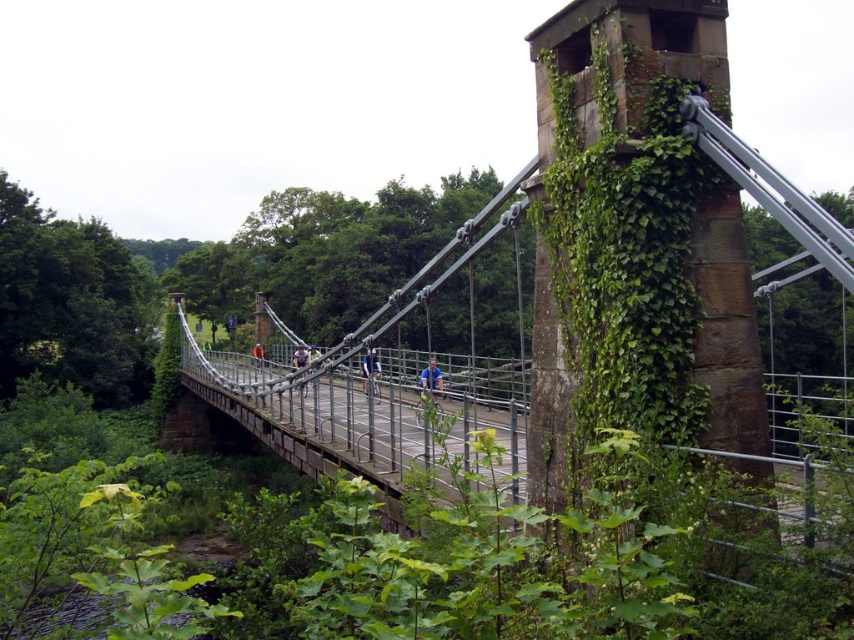
You are a pedestrian standing on the suspension bridge. You see a blue fabric jacket at center and a metallic silver bicycle at center. Which object is closer to your right side?

The blue fabric jacket at center is positioned on the right side of the metallic silver bicycle at center, so it is closer to your right side.

You are a hiker planning to cross the metallic gray bridge at center while wearing an orange fabric jacket at center. Considering their sizes, which one occupies more visual space in the image?

The metallic gray bridge at center has a larger size compared to the orange fabric jacket at center, so the bridge occupies more visual space in the image.